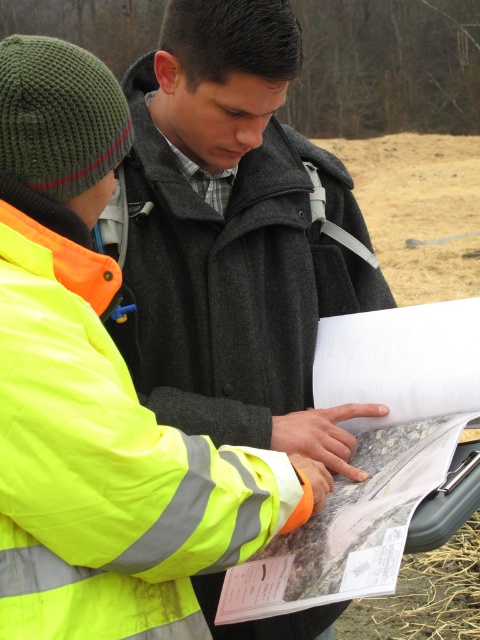
You are a delivery person trying to locate the neon yellow reflective jacket at left in an image. The image has a coordinate system where the bottom left corner is the origin. Can you determine if the neon yellow reflective jacket at left is located above or below the point with coordinates (96, 394)?

The neon yellow reflective jacket at left is located exactly at the point with coordinates (96, 394), so it is neither above nor below that point.

You are a photographer trying to capture a clear shot of the white paper at center while ensuring the matte gray coat at center is visible in the frame. Based on their positions, which object should you focus on first to include both in the photo?

The matte gray coat at center is positioned on the left side of white paper at center, so you should focus on the white paper at center first to ensure both objects are in the frame.

You are a delivery robot with a 24 inch wide package. You need to place the package between the neon yellow reflective jacket at left and the white paper at center. Is there enough space?

The distance between the neon yellow reflective jacket at left and the white paper at center is 24.47 inches. Since the package is 24 inches wide, there is enough space to place it between them.